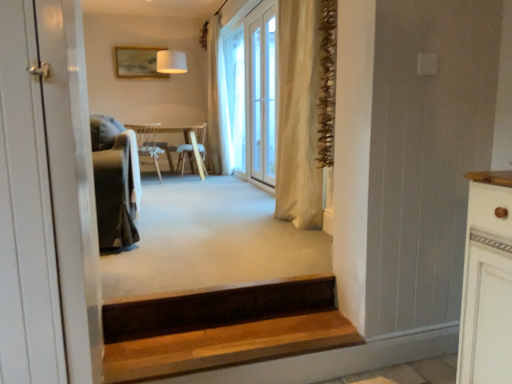
Question: Considering their positions, is beige fabric curtain at center, the 2th curtain in the right-to-left sequence, located in front of or behind wooden chair at center, which appears as the second chair when viewed from the back?

Choices:
 (A) front
 (B) behind

Answer: (B)

Question: Looking at their shapes, would you say beige fabric curtain at center, the 2th curtain in the right-to-left sequence, is wider or thinner than wooden chair at center, which appears as the second chair when viewed from the back?

Choices:
 (A) thin
 (B) wide

Answer: (A)

Question: Considering the real-world distances, which object is farthest from the wooden chair at center, which appears as the second chair when viewed from the back?

Choices:
 (A) beige fabric curtain at center, the first curtain in the front-to-back sequence
 (B) beige fabric curtain at center, the 2th curtain in the right-to-left sequence
 (C) wooden stairs at lower center
 (D) velvet green armchair at left
 (E) clear glass door at center

Answer: (C)

Question: Considering the real-world distances, which object is closest to the clear glass door at center?

Choices:
 (A) wooden chair at center, which appears as the second chair when viewed from the back
 (B) beige fabric curtain at center, the first curtain when ordered from back to front
 (C) wooden stairs at lower center
 (D) beige fabric curtain at center, which appears as the 2th curtain when viewed from the back
 (E) wooden chair at center, the 2th chair viewed from the front

Answer: (B)